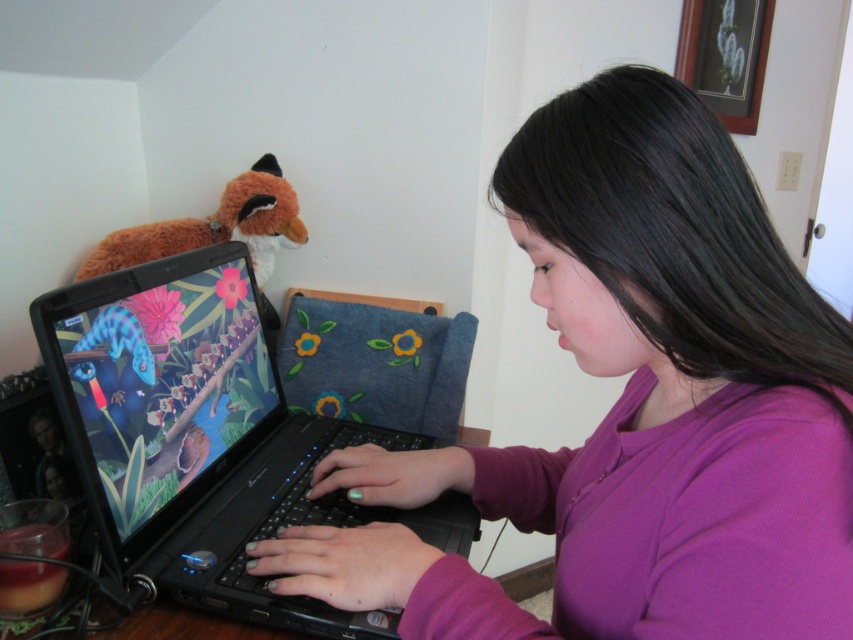
Who is more distant from viewer, (573, 230) or (103, 387)?

Point (103, 387)

Does point (809, 538) come farther from viewer compared to point (57, 305)?

No, (809, 538) is in front of (57, 305).

Identify the location of purple matte shirt at center. (633, 406).

Is purple matte shirt at center positioned in front of fuzzy orange fox at upper left?

That is True.

Can you confirm if purple matte shirt at center is positioned to the right of fuzzy orange fox at upper left?

Indeed, purple matte shirt at center is positioned on the right side of fuzzy orange fox at upper left.

Between point (685, 209) and point (289, 200), which one is positioned in front?

Point (685, 209) is more forward.

The width and height of the screenshot is (853, 640). Identify the location of purple matte shirt at center. (633, 406).

Does point (94, 454) lie behind point (206, 232)?

No, it is in front of (206, 232).

This screenshot has width=853, height=640. I want to click on black plastic laptop at center, so click(206, 438).